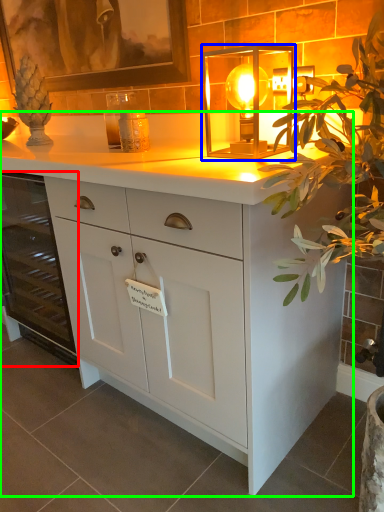
Question: Considering the real-world distances, which object is closest to cabinetry (highlighted by a red box)? lamp (highlighted by a blue box) or chest of drawers (highlighted by a green box).

Choices:
 (A) lamp
 (B) chest of drawers

Answer: (B)